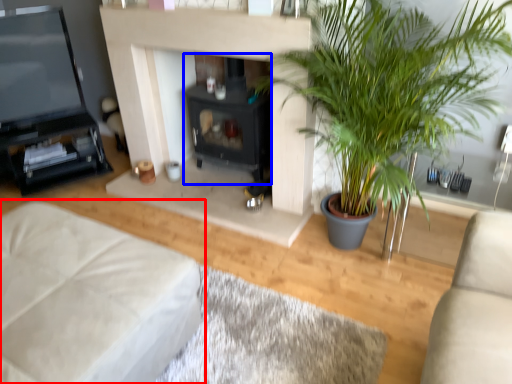
Question: Which point is closer to the camera, studio couch (highlighted by a red box) or fireplace (highlighted by a blue box)?

Choices:
 (A) studio couch
 (B) fireplace

Answer: (A)